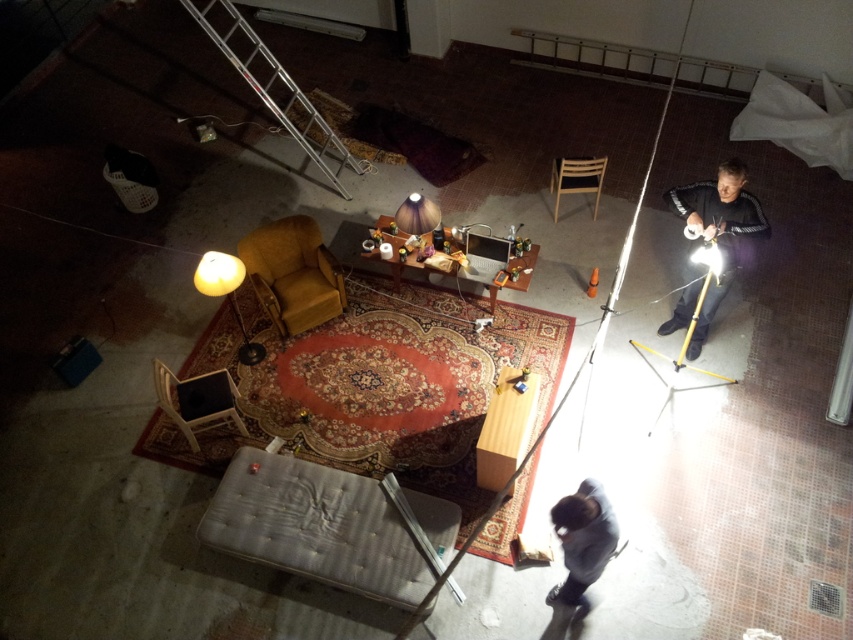
Who is more distant from viewer, (601, 529) or (225, 275)?

Positioned behind is point (225, 275).

Who is lower down, dark gray fabric at lower center or matte yellow lampshade at center?

Positioned lower is dark gray fabric at lower center.

Does point (569, 540) come farther from viewer compared to point (222, 284)?

No, (569, 540) is closer to viewer.

Find the location of a particular element. dark gray fabric at lower center is located at coordinates (582, 538).

Is light gray fabric ottoman at center bigger than matte yellow lampshade at center?

Yes, light gray fabric ottoman at center is bigger than matte yellow lampshade at center.

Is light gray fabric ottoman at center shorter than matte yellow lampshade at center?

No, light gray fabric ottoman at center is not shorter than matte yellow lampshade at center.

You are a GUI agent. You are given a task and a screenshot of the screen. Output one action in this format:
    pyautogui.click(x=<x>, y=<y>)
    Task: Click on the light gray fabric ottoman at center
    The height and width of the screenshot is (640, 853).
    Given the screenshot: What is the action you would take?
    pyautogui.click(x=329, y=525)

Is point (251, 472) less distant than point (408, 204)?

That is True.

Does light gray fabric ottoman at center have a smaller size compared to matte brown lampshade at center?

Incorrect, light gray fabric ottoman at center is not smaller in size than matte brown lampshade at center.

Identify the location of light gray fabric ottoman at center. (329, 525).